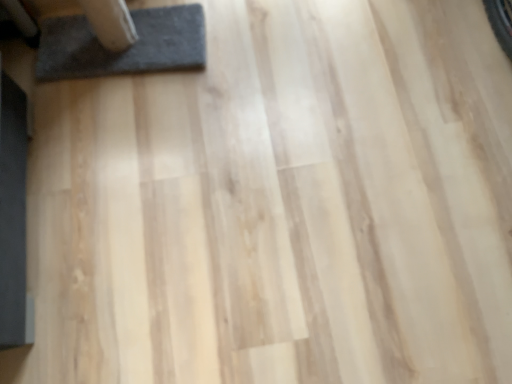
Identify the location of free space in front of black rubber mat at upper left. (135, 138).